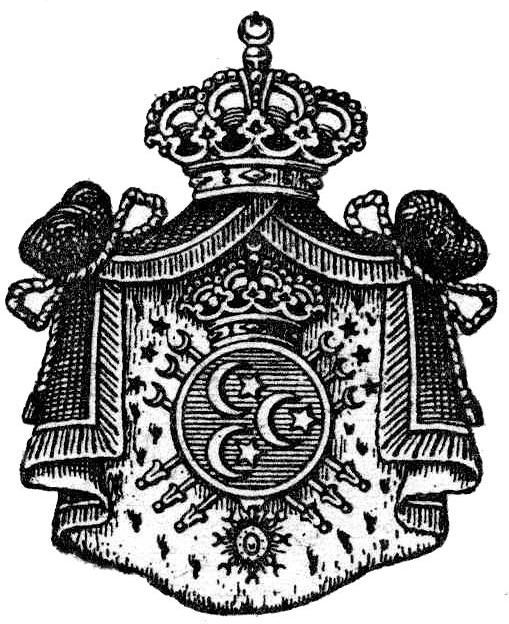
In order to click on tapestry in this screenshot , I will do `click(135, 545)`.